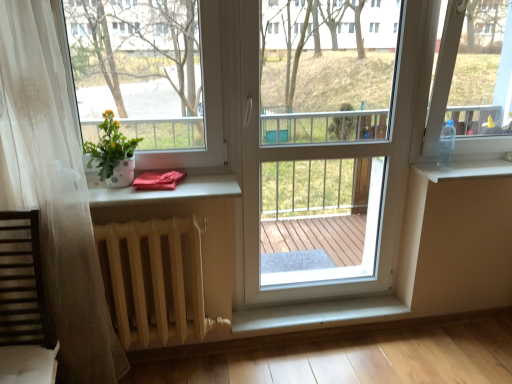
What do you see at coordinates (473, 77) in the screenshot? Image resolution: width=512 pixels, height=384 pixels. I see `transparent plastic bottle at right, the 2th window screen when ordered from left to right` at bounding box center [473, 77].

Where is `white plastic screen door at center`? white plastic screen door at center is located at coordinates (325, 160).

Locate an element on the screen. Image resolution: width=512 pixels, height=384 pixels. wooden slats rocking chair at lower left is located at coordinates (24, 304).

This screenshot has width=512, height=384. Describe the element at coordinates (139, 68) in the screenshot. I see `white glossy flower pot at left, which is counted as the 2th window screen, starting from the right` at that location.

Where is `white glossy flower pot at left, which is counted as the 2th window screen, starting from the right`? The height and width of the screenshot is (384, 512). white glossy flower pot at left, which is counted as the 2th window screen, starting from the right is located at coordinates pos(139,68).

What is the approximate width of white painted wood radiator at center?

white painted wood radiator at center is 6.23 inches in width.

Locate an element on the screen. The width and height of the screenshot is (512, 384). transparent plastic bottle at right, the 2th window screen when ordered from left to right is located at coordinates (473, 77).

Consider the image. Who is taller, white painted wood radiator at center or white glossy flower pot at left, which is counted as the 2th window screen, starting from the right?

white glossy flower pot at left, which is counted as the 2th window screen, starting from the right, is taller.

Looking at this image, which of these two, white painted wood radiator at center or white glossy flower pot at left, which is counted as the 2th window screen, starting from the right, is wider?

Wider between the two is white painted wood radiator at center.

From the image's perspective, which one is positioned lower, white painted wood radiator at center or white glossy flower pot at left, which is the 1th window screen from left to right?

white painted wood radiator at center is shown below in the image.

From the image's perspective, is wooden slats rocking chair at lower left located beneath white plastic screen door at center?

Indeed, from the image's perspective, wooden slats rocking chair at lower left is shown beneath white plastic screen door at center.

Is wooden slats rocking chair at lower left further to the viewer compared to white plastic screen door at center?

No, it is in front of white plastic screen door at center.

Considering the positions of points (38, 352) and (247, 60), is point (38, 352) closer to camera compared to point (247, 60)?

Yes, it is in front of point (247, 60).

The width and height of the screenshot is (512, 384). I want to click on screen door located on the right of wooden slats rocking chair at lower left, so click(325, 160).

Which of these two, white glossy pot at left or white painted wood radiator at center, is smaller?

Smaller between the two is white glossy pot at left.

Which is nearer, (x=110, y=166) or (x=108, y=241)?

Positioned in front is point (x=108, y=241).

Considering the relative positions of white glossy pot at left and white painted wood radiator at center in the image provided, is white glossy pot at left to the left or to the right of white painted wood radiator at center?

white glossy pot at left is to the left of white painted wood radiator at center.

Identify the location of window screen in front of the white glossy pot at left. (139, 68).

Between point (121, 168) and point (106, 78), which one is positioned in front?

The point (121, 168) is more forward.

From the image's perspective, between white glossy pot at left and white glossy flower pot at left, which is the 1th window screen from left to right, which one is located above?

white glossy flower pot at left, which is the 1th window screen from left to right.

Considering the sizes of transparent plastic bottle at right, the 2th window screen when ordered from left to right, and white painted wood radiator at center in the image, is transparent plastic bottle at right, the 2th window screen when ordered from left to right, wider or thinner than white painted wood radiator at center?

Clearly, transparent plastic bottle at right, the 2th window screen when ordered from left to right, has more width compared to white painted wood radiator at center.

Between transparent plastic bottle at right, positioned as the first window screen in right-to-left order, and white painted wood radiator at center, which one has larger size?

Bigger between the two is transparent plastic bottle at right, positioned as the first window screen in right-to-left order.

Is transparent plastic bottle at right, the 2th window screen when ordered from left to right, looking in the opposite direction of white painted wood radiator at center?

transparent plastic bottle at right, the 2th window screen when ordered from left to right, does not have its back to white painted wood radiator at center.

Considering the positions of objects transparent plastic bottle at right, the 2th window screen when ordered from left to right, and white painted wood radiator at center in the image provided, who is in front, transparent plastic bottle at right, the 2th window screen when ordered from left to right, or white painted wood radiator at center?

white painted wood radiator at center.

Consider the image. Considering their positions, is white plastic window sill at right located in front of or behind white glossy pot at left?

Clearly, white plastic window sill at right is behind white glossy pot at left.

From a real-world perspective, which object rests below the other?

From a 3D spatial view, white plastic window sill at right is below.

How much distance is there between white plastic window sill at right and white glossy pot at left?

They are 4.78 feet apart.

Which is correct: white plastic window sill at right is inside white glossy pot at left, or outside of it?

white plastic window sill at right is outside white glossy pot at left.

Is white glossy flower pot at left, which is the 1th window screen from left to right, not inside white plastic screen door at center?

Indeed, white glossy flower pot at left, which is the 1th window screen from left to right, is completely outside white plastic screen door at center.

Is point (94, 83) closer or farther from the camera than point (381, 200)?

Clearly, point (94, 83) is closer to the camera than point (381, 200).

From the image's perspective, between white glossy flower pot at left, which is counted as the 2th window screen, starting from the right, and white plastic screen door at center, which one is located above?

white glossy flower pot at left, which is counted as the 2th window screen, starting from the right, from the image's perspective.

What are the coordinates of `screen door below the white glossy flower pot at left, which is the 1th window screen from left to right (from the image's perspective)` in the screenshot? It's located at (325, 160).

You are a GUI agent. You are given a task and a screenshot of the screen. Output one action in this format:
    pyautogui.click(x=<x>, y=<y>)
    Task: Click on the radiator behind the white glossy flower pot at left, which is the 1th window screen from left to right
    The image size is (512, 384).
    Given the screenshot: What is the action you would take?
    pyautogui.click(x=157, y=277)

In order to click on rocking chair below the white plastic screen door at center (from the image's perspective) in this screenshot , I will do `click(24, 304)`.

From the image, which object appears to be nearer to white glossy flower pot at left, which is counted as the 2th window screen, starting from the right, transparent plastic bottle at right, the 2th window screen when ordered from left to right, or white plastic screen door at center?

The object closer to white glossy flower pot at left, which is counted as the 2th window screen, starting from the right, is white plastic screen door at center.

From the image, which object appears to be nearer to white glossy pot at left, white plastic window sill at right or white glossy flower pot at left, which is the 1th window screen from left to right?

white glossy flower pot at left, which is the 1th window screen from left to right, lies closer to white glossy pot at left than the other object.

Estimate the real-world distances between objects in this image. Which object is further from white plastic window sill at right, white glossy pot at left or white glossy flower pot at left, which is counted as the 2th window screen, starting from the right?

The object further to white plastic window sill at right is white glossy pot at left.

Which object lies further to the anchor point white painted wood radiator at center, white plastic window sill at right or white glossy pot at left?

white plastic window sill at right is positioned further to the anchor white painted wood radiator at center.

Based on their spatial positions, is wooden slats rocking chair at lower left or white plastic screen door at center further from white plastic window sill at right?

wooden slats rocking chair at lower left is positioned further to the anchor white plastic window sill at right.

Looking at the image, which one is located further to white glossy flower pot at left, which is counted as the 2th window screen, starting from the right, white glossy pot at left or white painted wood radiator at center?

Among the two, white painted wood radiator at center is located further to white glossy flower pot at left, which is counted as the 2th window screen, starting from the right.

From the picture: Looking at the image, which one is located closer to wooden slats rocking chair at lower left, white glossy flower pot at left, which is counted as the 2th window screen, starting from the right, or white glossy pot at left?

The object closer to wooden slats rocking chair at lower left is white glossy pot at left.

Which object lies further to the anchor point wooden slats rocking chair at lower left, white plastic screen door at center or transparent plastic bottle at right, positioned as the first window screen in right-to-left order?

transparent plastic bottle at right, positioned as the first window screen in right-to-left order, lies further to wooden slats rocking chair at lower left than the other object.

Find the location of a particular element. window screen between wooden slats rocking chair at lower left and white plastic screen door at center in the horizontal direction is located at coordinates (139, 68).

I want to click on houseplant between white glossy flower pot at left, which is the 1th window screen from left to right, and wooden slats rocking chair at lower left in the up-down direction, so click(113, 153).

Find the location of a particular element. This screenshot has height=384, width=512. window screen situated between white painted wood radiator at center and transparent plastic bottle at right, the 2th window screen when ordered from left to right, from left to right is located at coordinates (139, 68).

What are the coordinates of `screen door situated between white glossy pot at left and transparent plastic bottle at right, the 2th window screen when ordered from left to right, from left to right` in the screenshot? It's located at point(325,160).